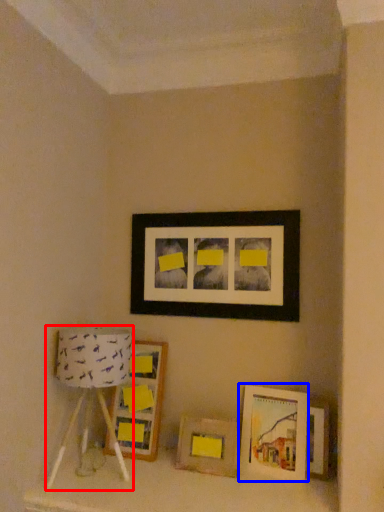
Question: Among these objects, which one is farthest to the camera, table lamp (highlighted by a red box) or picture frame (highlighted by a blue box)?

Choices:
 (A) table lamp
 (B) picture frame

Answer: (B)